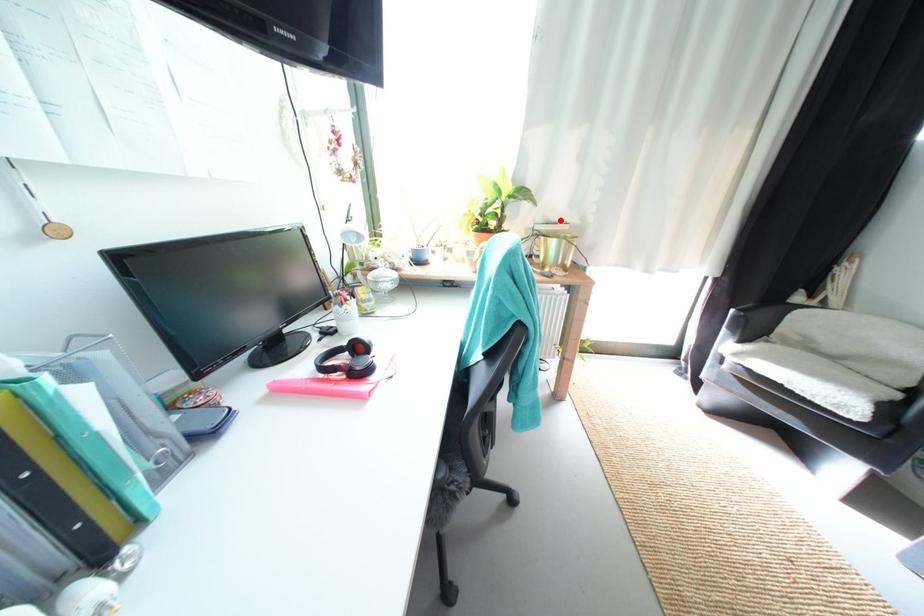
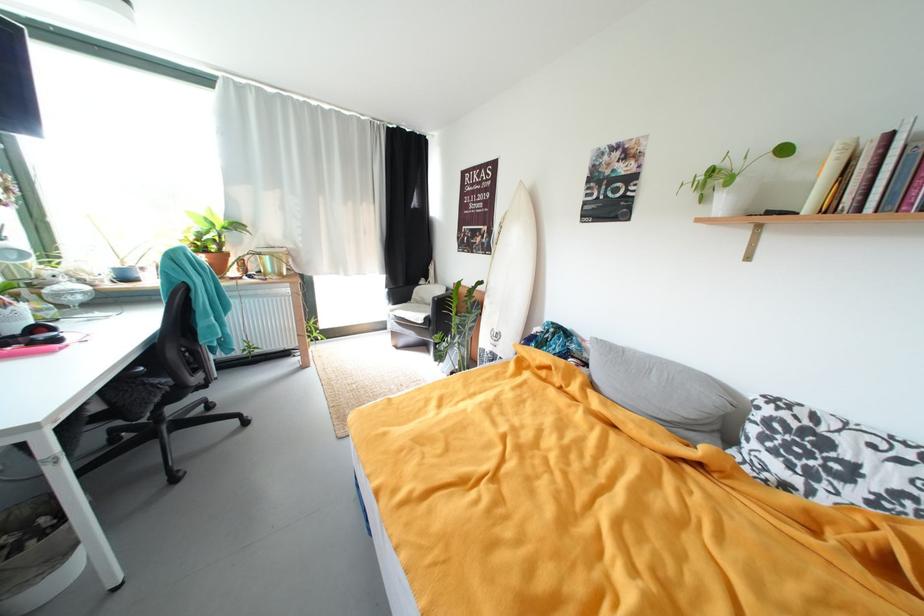
Locate, in the second image, the point that corresponds to the highlighted location in the first image.

(281, 246)